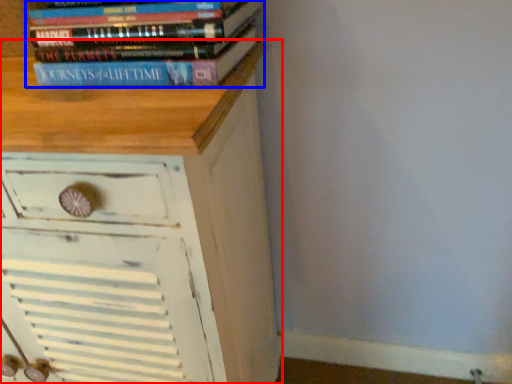
Question: Which of the following is the closest to the observer, chest of drawers (highlighted by a red box) or book (highlighted by a blue box)?

Choices:
 (A) chest of drawers
 (B) book

Answer: (A)